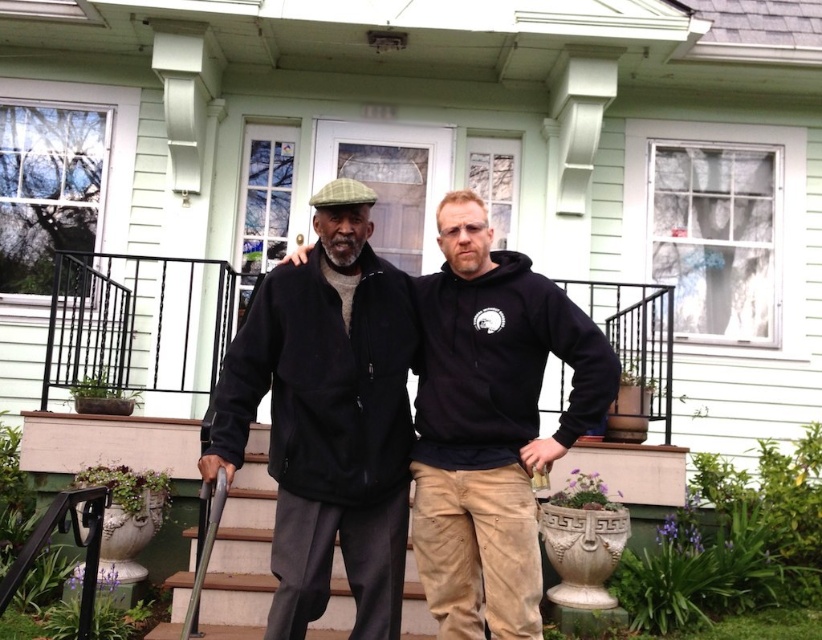
Question: Is black fleece sweatshirt at center positioned behind white painted wood porch at center?

Choices:
 (A) no
 (B) yes

Answer: (A)

Question: Is black hoodie at center bigger than white painted wood porch at center?

Choices:
 (A) no
 (B) yes

Answer: (A)

Question: Estimate the real-world distances between objects in this image. Which object is farther from the black matte jacket at center?

Choices:
 (A) black hoodie at center
 (B) white painted wood porch at center
 (C) white painted wood stairs at center
 (D) black fleece sweatshirt at center

Answer: (B)

Question: Which object is positioned farthest from the black fleece hoodie at center?

Choices:
 (A) black fleece sweatshirt at center
 (B) white painted wood porch at center

Answer: (B)

Question: Does black matte jacket at center have a lesser width compared to white painted wood stairs at center?

Choices:
 (A) yes
 (B) no

Answer: (B)

Question: Which object is positioned closest to the black matte jacket at center?

Choices:
 (A) white painted wood porch at center
 (B) black hoodie at center
 (C) black fleece sweatshirt at center

Answer: (B)